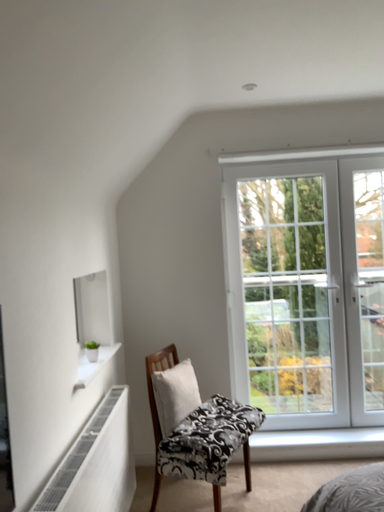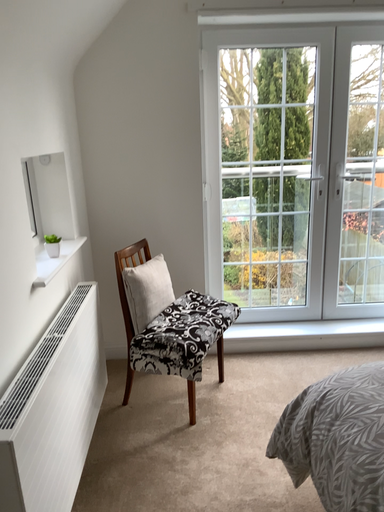
Question: How did the camera likely rotate when shooting the video?

Choices:
 (A) rotated downward
 (B) rotated upward

Answer: (A)